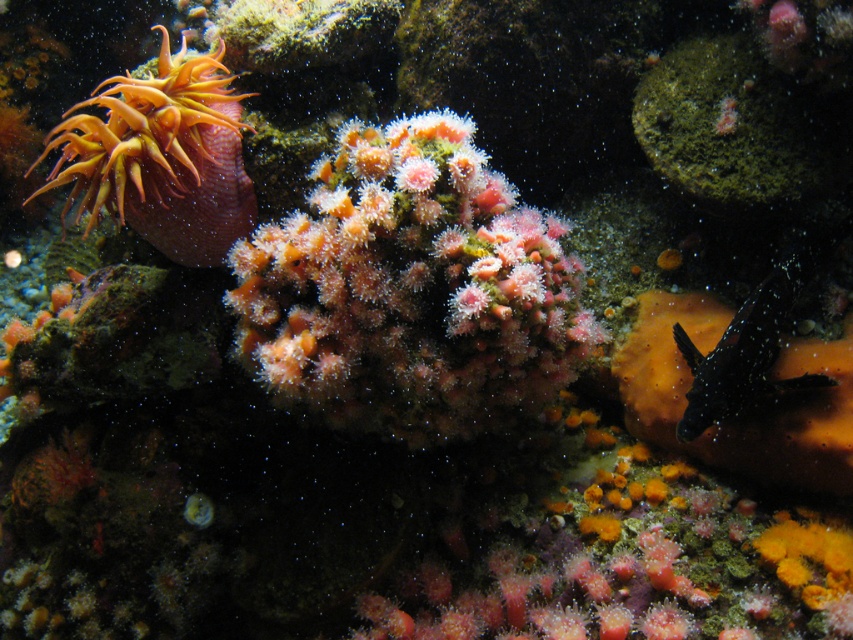
Question: Is pink fuzzy coral at center positioned at the back of black dotted clownfish at right?

Choices:
 (A) no
 (B) yes

Answer: (A)

Question: Does pink fuzzy coral at center lie behind orange soft coral at upper left?

Choices:
 (A) yes
 (B) no

Answer: (B)

Question: Which object is closer to the camera taking this photo?

Choices:
 (A) pink fuzzy coral at center
 (B) black dotted clownfish at right
 (C) orange soft coral at upper left

Answer: (A)

Question: Where is orange soft coral at upper left located in relation to black dotted clownfish at right in the image?

Choices:
 (A) below
 (B) above

Answer: (B)

Question: Considering the real-world distances, which object is closest to the orange soft coral at upper left?

Choices:
 (A) pink fuzzy coral at center
 (B) black dotted clownfish at right

Answer: (A)

Question: Which point is farther from the camera taking this photo?

Choices:
 (A) click(376, 260)
 (B) click(769, 342)

Answer: (B)